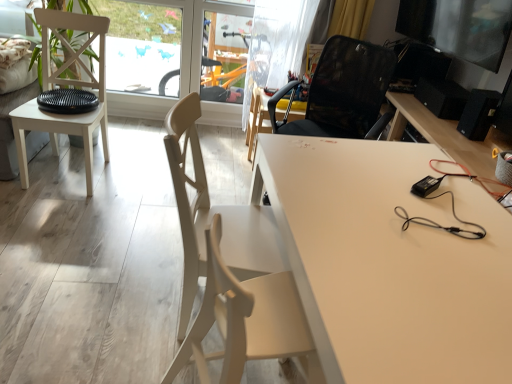
Image resolution: width=512 pixels, height=384 pixels. I want to click on free point in front of white matte chair at left, which is the second chair from back to front, so click(x=58, y=210).